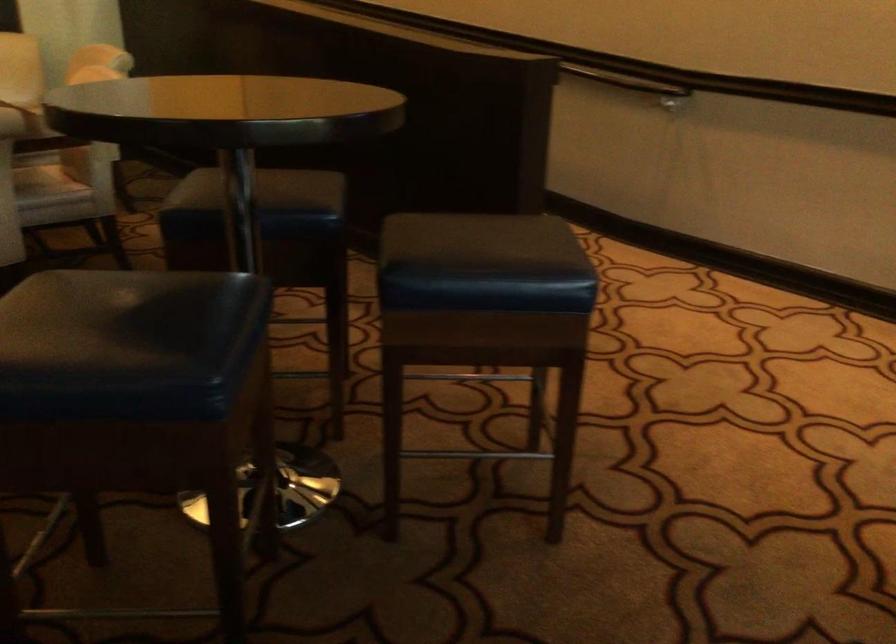
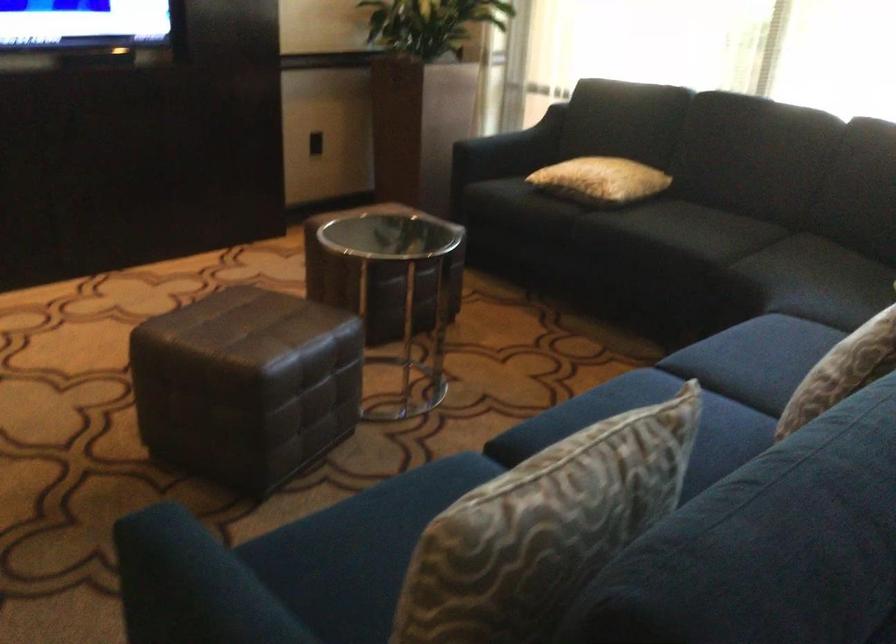
How did the camera likely rotate?

The rotation direction of the camera is right-down.